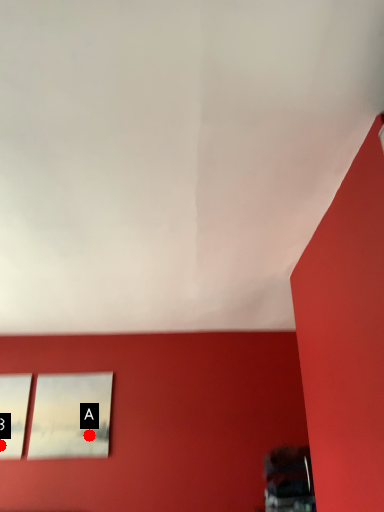
Question: Two points are circled on the image, labeled by A and B beside each circle. Which point is farther from the camera taking this photo?

Choices:
 (A) A is further
 (B) B is further

Answer: (A)